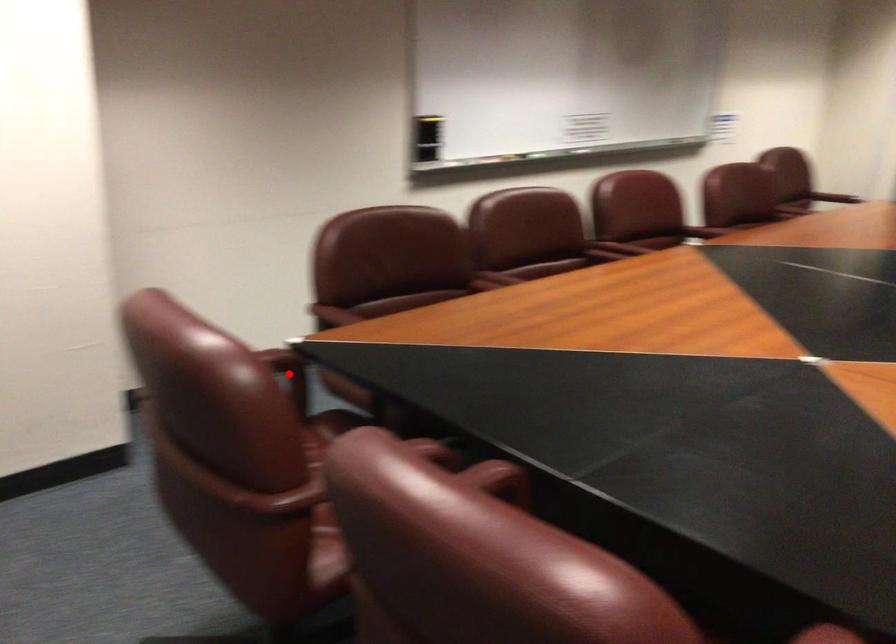
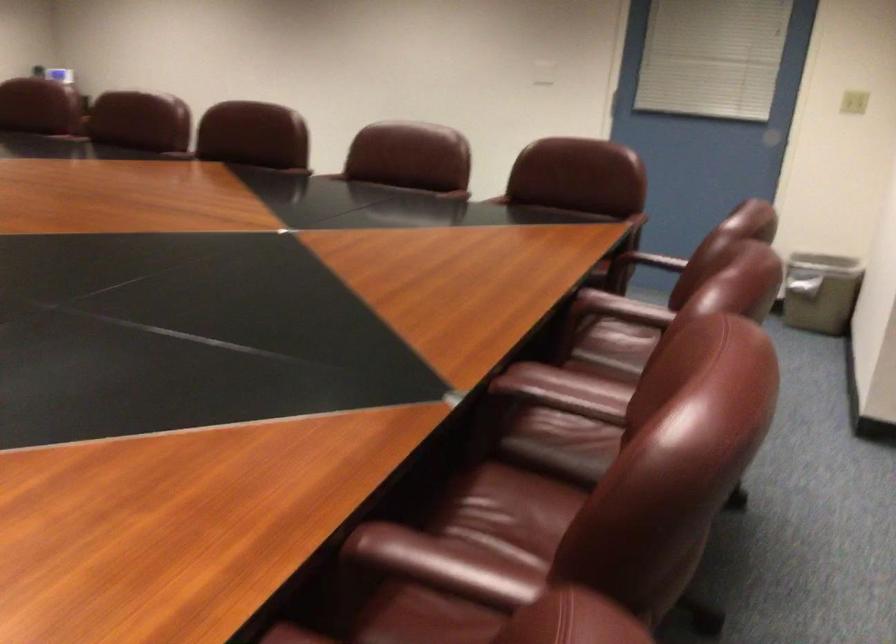
Question: I am providing you with two images of the same scene from different viewpoints. A red point is marked on the first image. At the location where the point appears in image 1, is it still visible in image 2?

Choices:
 (A) Yes
 (B) No

Answer: (B)